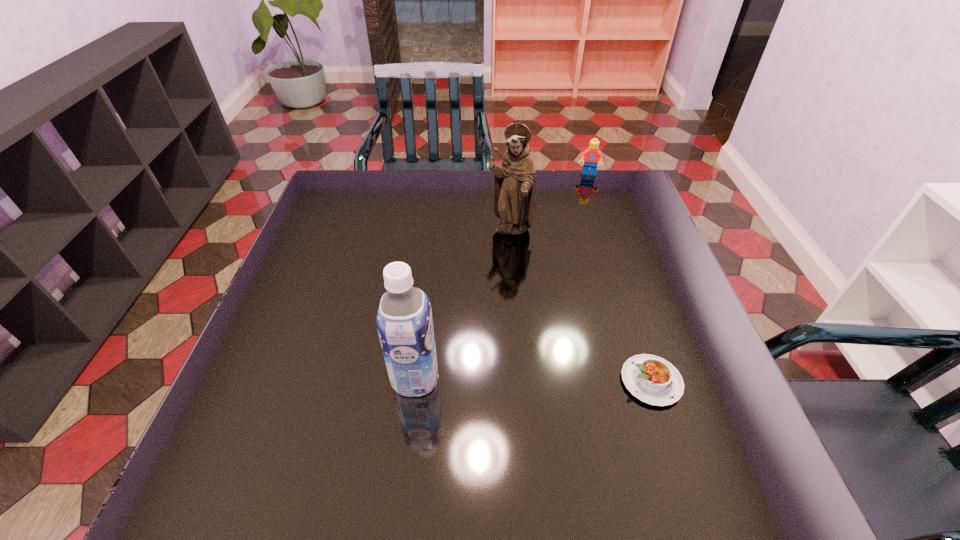
Where is `free spot on the desktop that is between the leftmost object and the pudding and is positioned on the front-facing side of the figurine`? free spot on the desktop that is between the leftmost object and the pudding and is positioned on the front-facing side of the figurine is located at coordinates (542, 380).

The width and height of the screenshot is (960, 540). Identify the location of vacant space on the desktop that is between the soya milk and the shortest object and is positioned on the face of the second shortest object. (567, 381).